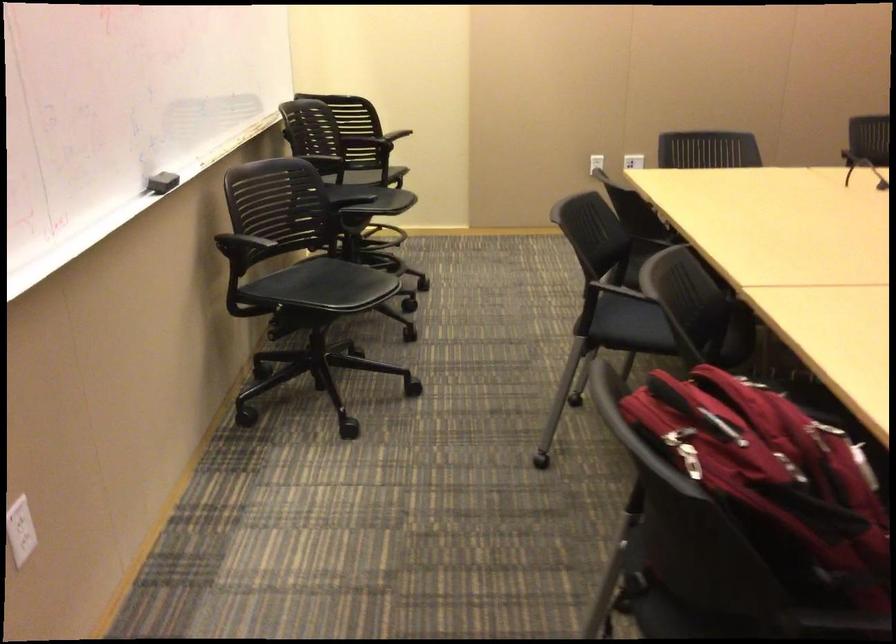
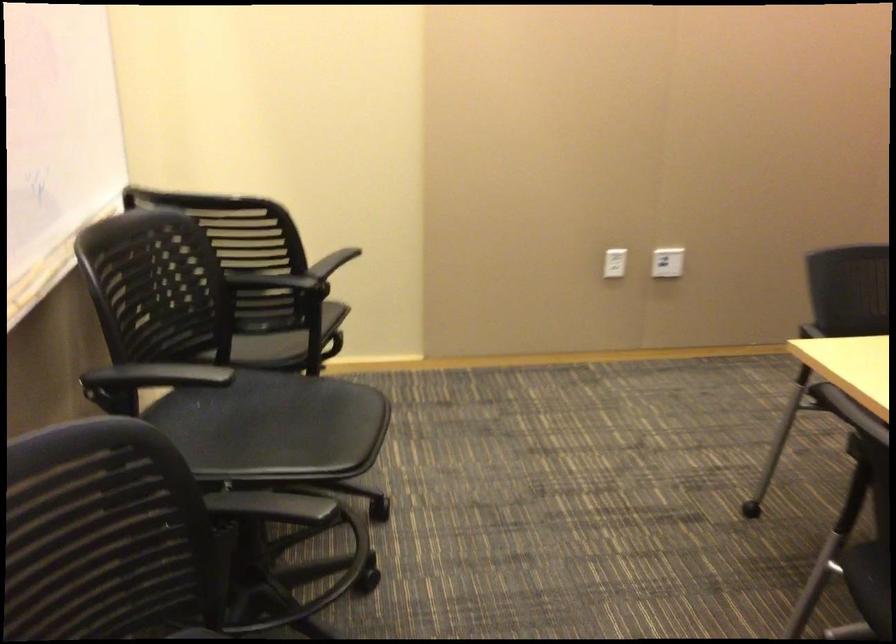
Question: Which direction would the cameraman need to move to produce the second image? Reply with the corresponding letter.

Choices:
 (A) Left
 (B) Right
 (C) Forward
 (D) Backward

Answer: (C)